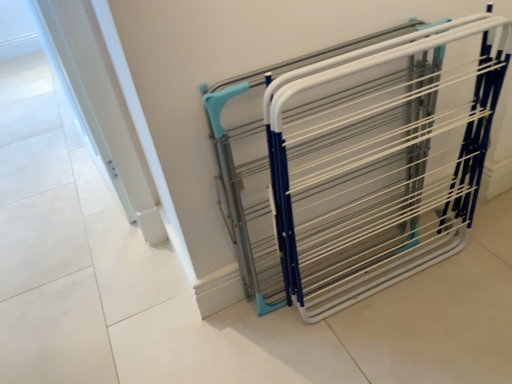
Identify the location of free space in front of white metal gate at center. (397, 333).